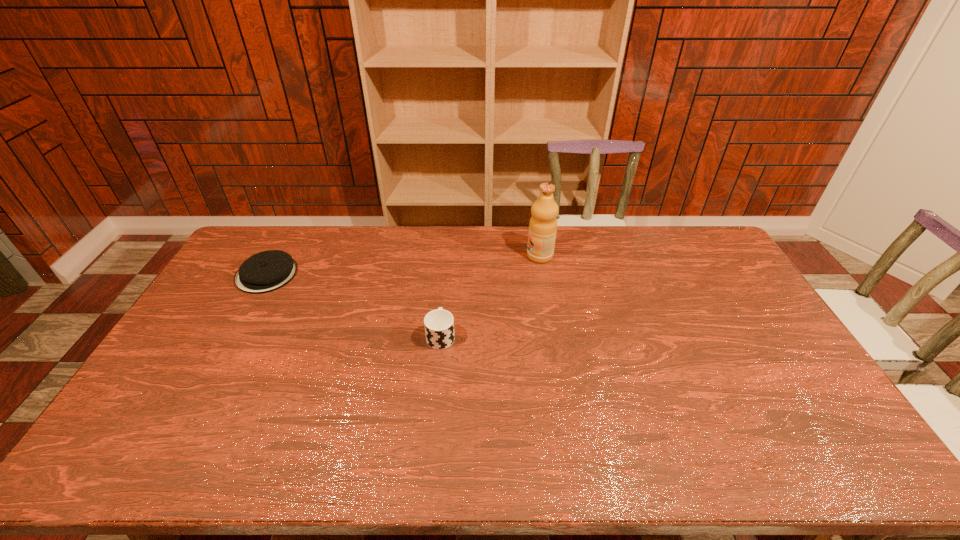
What are the coordinates of `fruit juice` in the screenshot? It's located at click(543, 224).

Image resolution: width=960 pixels, height=540 pixels. Find the location of `the rightmost object`. the rightmost object is located at coordinates point(543,224).

Find the location of a particular element. cup is located at coordinates (439, 324).

The height and width of the screenshot is (540, 960). In order to click on the second object from right to left in this screenshot , I will do `click(439, 324)`.

Locate an element on the screen. The width and height of the screenshot is (960, 540). the leftmost object is located at coordinates (266, 271).

Identify the location of the shortest object. The image size is (960, 540). (266, 271).

Find the location of a particular element. The width and height of the screenshot is (960, 540). free space located on the front label of the fruit juice is located at coordinates [422, 256].

This screenshot has height=540, width=960. Find the location of `vacant space located on the front label of the fruit juice`. vacant space located on the front label of the fruit juice is located at coordinates (492, 256).

Image resolution: width=960 pixels, height=540 pixels. In order to click on free region located on the front label of the fruit juice in this screenshot , I will do `click(478, 256)`.

At what (x,y) coordinates should I click in order to perform the action: click on free space located 0.280m on the side of the cup with the handle. Please return your answer as a coordinate pair (x, y). Looking at the image, I should click on (447, 266).